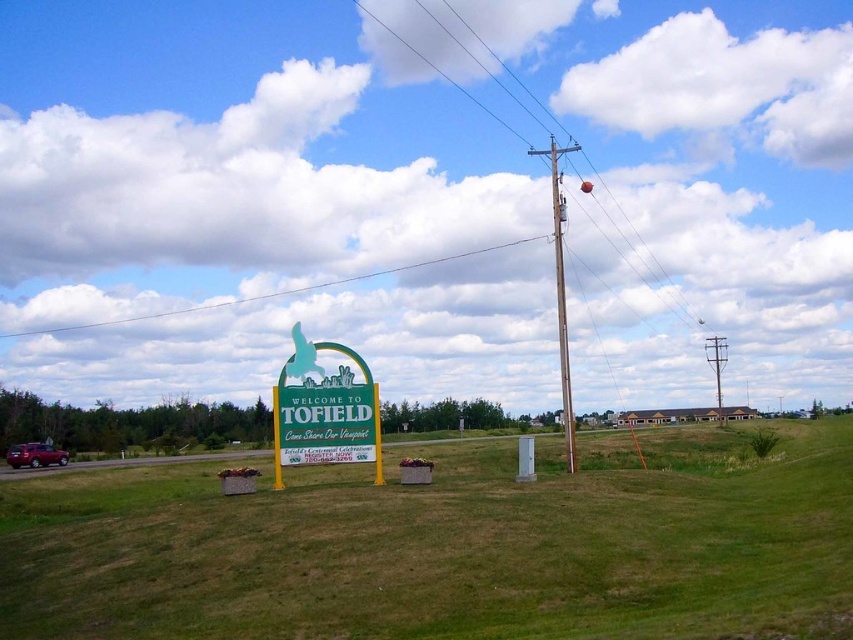
You are a visitor arriving at Tofield and see the green plastic sign at center and the white wire at upper center. Which object is positioned higher in the image?

The white wire at upper center is positioned higher than the green plastic sign at center.

You are standing at the edge of the green grassy field at center and looking towards the brown wooden telegraph pole at upper center. Which object is taller?

The brown wooden telegraph pole at upper center is taller than the green grassy field at center.